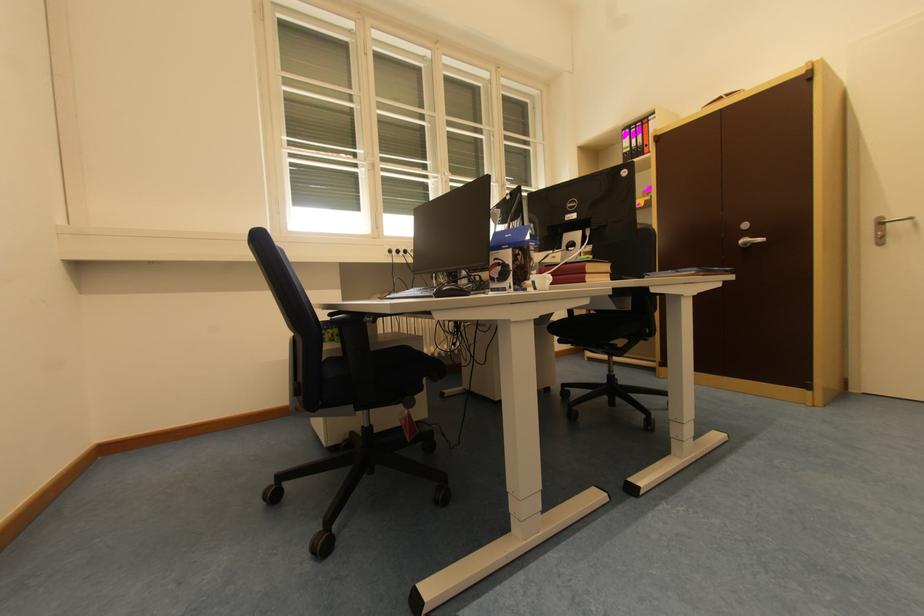
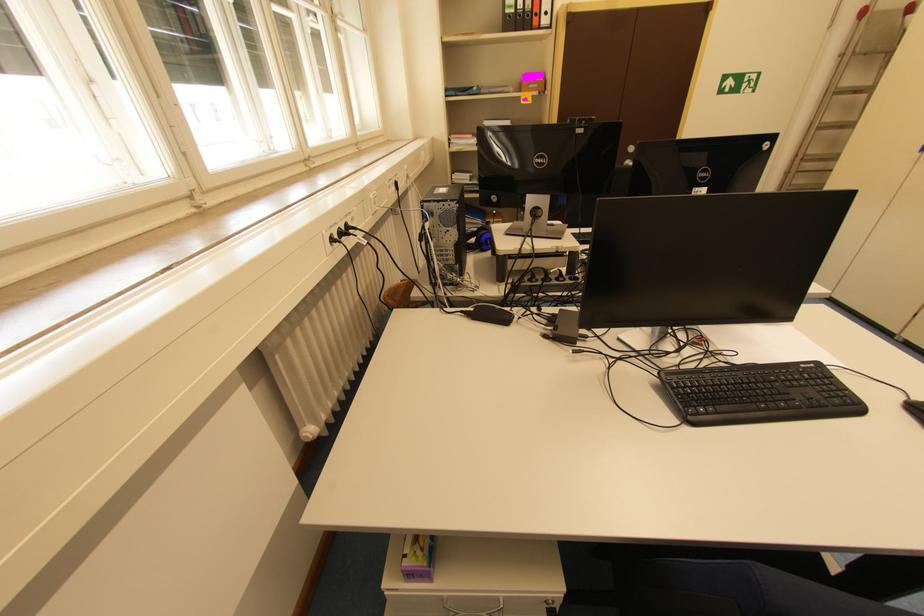
Where in the second image is the point corresponding to point (636, 151) from the first image?

(520, 12)